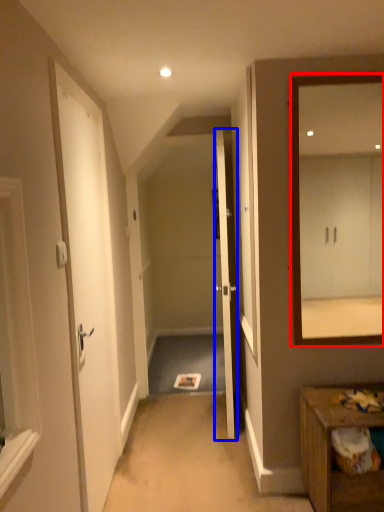
Question: Which of the following is the farthest to the observer, mirror (highlighted by a red box) or door (highlighted by a blue box)?

Choices:
 (A) mirror
 (B) door

Answer: (B)